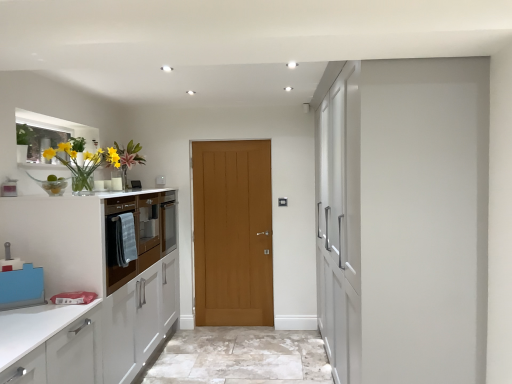
You are a GUI agent. You are given a task and a screenshot of the screen. Output one action in this format:
    pyautogui.click(x=<x>, y=<y>)
    Task: Click on the vacant area that is in front of wooden door at center
    The width and height of the screenshot is (512, 384).
    Given the screenshot: What is the action you would take?
    pyautogui.click(x=231, y=341)